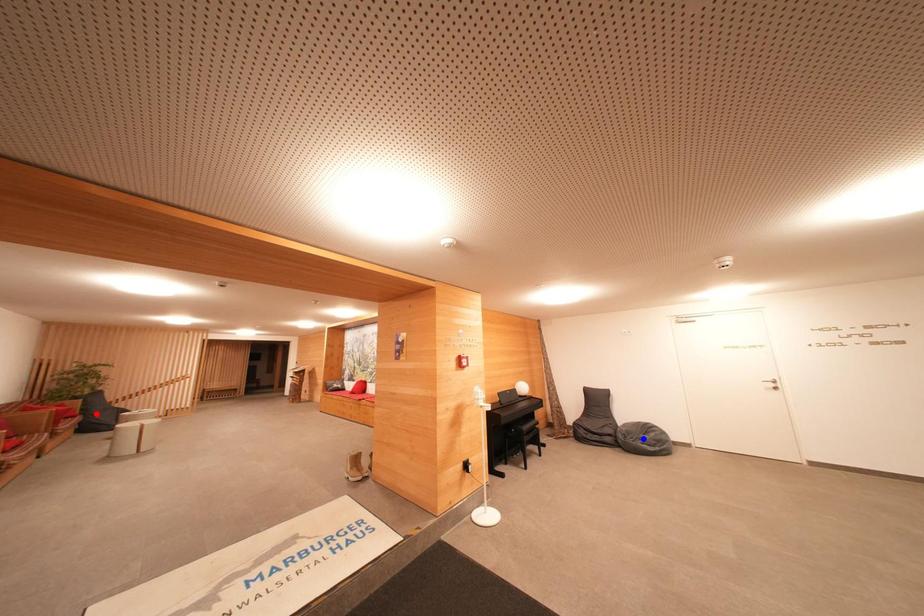
Question: Two points are marked on the image. Which point is closer to the camera?

Choices:
 (A) Blue point is closer.
 (B) Red point is closer.

Answer: (B)